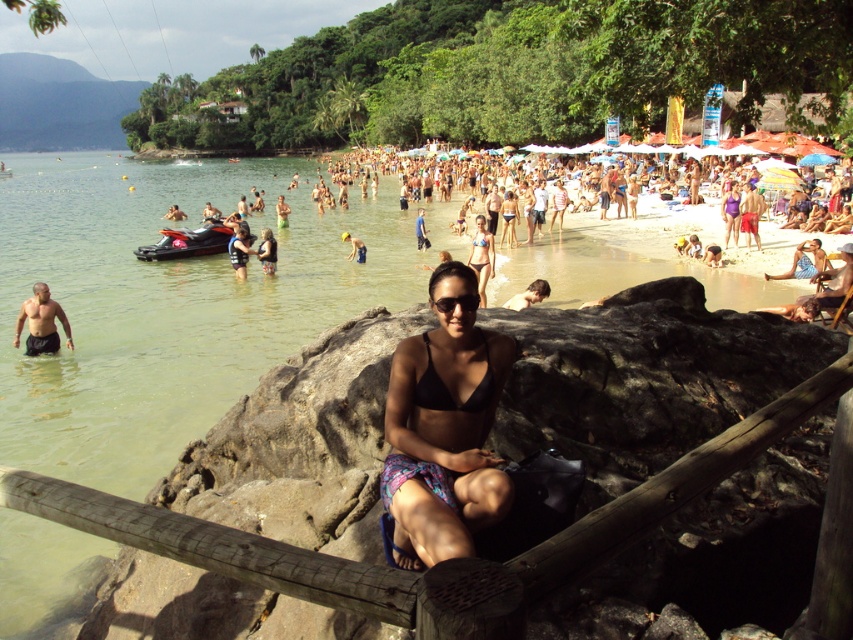
Question: Which point is farther to the camera?

Choices:
 (A) black bikini at center
 (B) black matte bikini top at center

Answer: (B)

Question: In this image, where is skinny man at left located relative to smooth tan skin at center?

Choices:
 (A) above
 (B) below

Answer: (B)

Question: Which of the following is the farthest from the observer?

Choices:
 (A) (735, 214)
 (B) (39, 346)
 (C) (480, 380)

Answer: (A)

Question: Which of the following is the farthest from the observer?

Choices:
 (A) (489, 376)
 (B) (473, 269)
 (C) (53, 353)

Answer: (C)

Question: From the image, what is the correct spatial relationship of skinny man at left in relation to blue denim shorts at center?

Choices:
 (A) below
 (B) above

Answer: (A)

Question: Can you confirm if purple matte swimsuit at center is thinner than blue life vest at center?

Choices:
 (A) no
 (B) yes

Answer: (B)